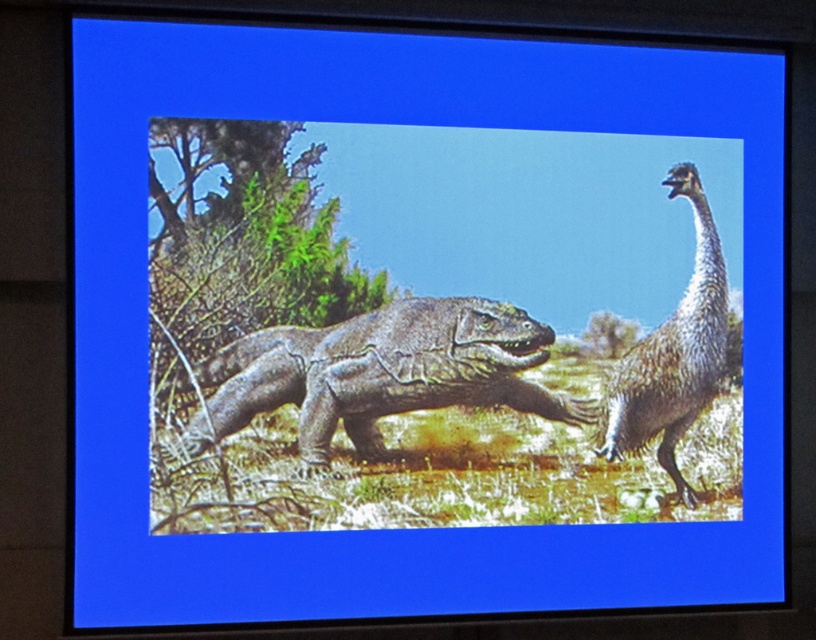
Question: Which point is farther to the camera?

Choices:
 (A) (277, 340)
 (B) (657, 420)

Answer: (B)

Question: Among these points, which one is farthest from the camera?

Choices:
 (A) (723, 333)
 (B) (269, 346)

Answer: (A)

Question: Is gray scaly dinosaur at center to the right of gray textured dinosaur at right from the viewer's perspective?

Choices:
 (A) no
 (B) yes

Answer: (A)

Question: Is gray scaly dinosaur at center to the right of gray textured dinosaur at right from the viewer's perspective?

Choices:
 (A) no
 (B) yes

Answer: (A)

Question: Does gray scaly dinosaur at center lie behind gray textured dinosaur at right?

Choices:
 (A) no
 (B) yes

Answer: (A)